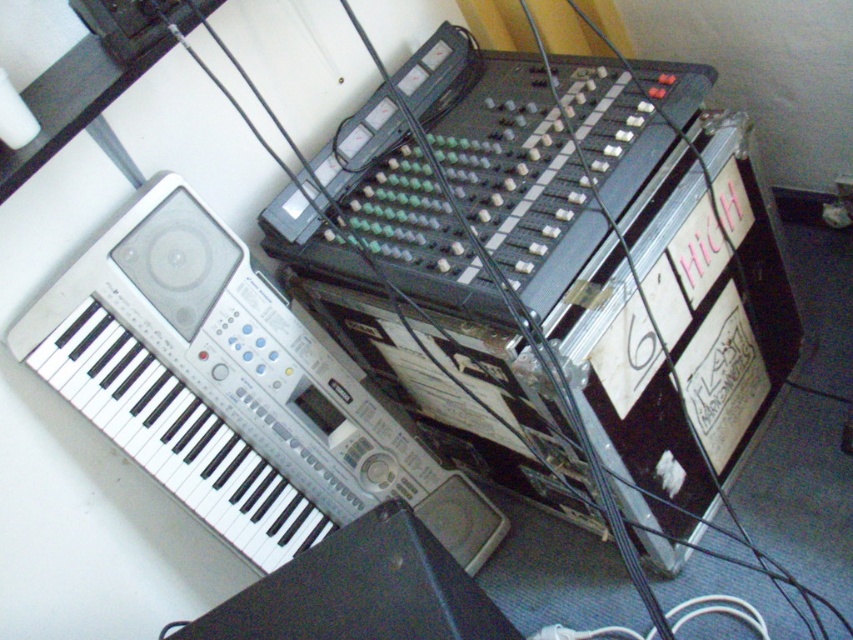
Does metallic gray mixer at center appear on the right side of black plastic speaker at lower left?

Yes, metallic gray mixer at center is to the right of black plastic speaker at lower left.

Which is more to the left, metallic gray mixer at center or black plastic speaker at lower left?

Positioned to the left is black plastic speaker at lower left.

Identify the location of metallic gray mixer at center. (558, 272).

Can you confirm if white plastic keyboard at upper left is positioned above black plastic speaker at lower left?

Correct, white plastic keyboard at upper left is located above black plastic speaker at lower left.

Is point (219, 412) farther from viewer compared to point (442, 616)?

Yes, it is behind point (442, 616).

Locate an element on the screen. The width and height of the screenshot is (853, 640). white plastic keyboard at upper left is located at coordinates (233, 390).

Does metallic gray mixer at center appear under white plastic keyboard at upper left?

Incorrect, metallic gray mixer at center is not positioned below white plastic keyboard at upper left.

This screenshot has height=640, width=853. Describe the element at coordinates (558, 272) in the screenshot. I see `metallic gray mixer at center` at that location.

Identify the location of metallic gray mixer at center. [558, 272].